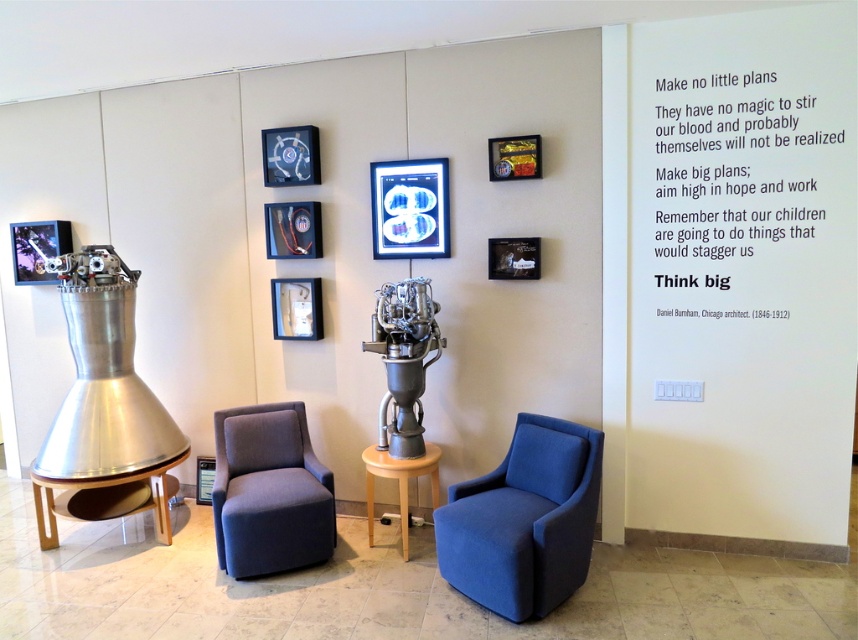
Question: Which point appears closest to the camera in this image?

Choices:
 (A) (293, 228)
 (B) (44, 221)
 (C) (520, 273)

Answer: (C)

Question: Based on their relative distances, which object is farther from the metallic blue picture frame at upper center?

Choices:
 (A) metallic picture frame at left
 (B) wooden polished table at lower left
 (C) matte black picture frame at upper center

Answer: (B)

Question: Which object appears closest to the camera in this image?

Choices:
 (A) metallic blue frame at center
 (B) light wood/finely polished side table at center

Answer: (B)

Question: Is wooden polished table at lower left bigger than metallic picture frame at left?

Choices:
 (A) no
 (B) yes

Answer: (B)

Question: Is metallic picture frame at left above matte black picture frame at upper center?

Choices:
 (A) yes
 (B) no

Answer: (A)

Question: Considering the relative positions of blue fabric swivel chair at center and metallic gold picture frame at upper center in the image provided, where is blue fabric swivel chair at center located with respect to metallic gold picture frame at upper center?

Choices:
 (A) left
 (B) right

Answer: (A)